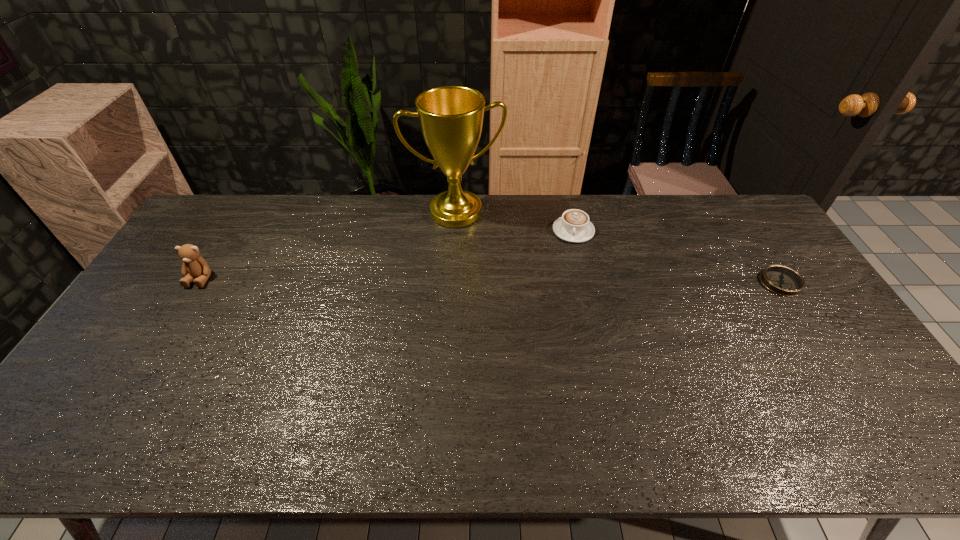
At what (x,y) coordinates should I click in order to perform the action: click on vacant area at the far edge of the desktop. Please return your answer as a coordinate pair (x, y). Looking at the image, I should click on (504, 213).

Image resolution: width=960 pixels, height=540 pixels. Identify the location of vacant point at the near edge. (287, 397).

Where is `vacant area at the left edge of the desktop`? vacant area at the left edge of the desktop is located at coordinates (169, 299).

Where is `vacant space at the right edge`? The height and width of the screenshot is (540, 960). vacant space at the right edge is located at coordinates (751, 269).

Identify the location of empty space between the award and the shortest object. This screenshot has height=540, width=960. (618, 247).

The image size is (960, 540). I want to click on vacant area that lies between the award and the rightmost object, so click(618, 247).

Locate an element on the screen. Image resolution: width=960 pixels, height=540 pixels. free space between the cappuccino and the tallest object is located at coordinates (515, 221).

The height and width of the screenshot is (540, 960). What are the coordinates of `vacant point located between the third tallest object and the third shortest object` in the screenshot? It's located at (387, 254).

Identify the location of free space between the compass and the third shortest object. coord(491,280).

At what (x,y) coordinates should I click in order to perform the action: click on free space between the tallest object and the rightmost object. Please return your answer as a coordinate pair (x, y). This screenshot has height=540, width=960. Looking at the image, I should click on (618, 247).